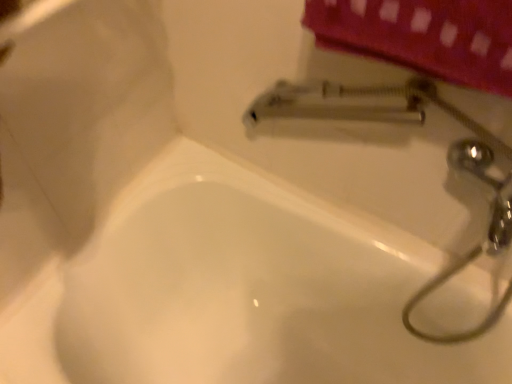
Find the location of a particular element. chrome metallic faucet at upper right is located at coordinates (447, 159).

This screenshot has height=384, width=512. Describe the element at coordinates (447, 159) in the screenshot. I see `chrome metallic faucet at upper right` at that location.

At what (x,y) coordinates should I click in order to perform the action: click on chrome metallic faucet at upper right. Please return your answer as a coordinate pair (x, y). Image resolution: width=512 pixels, height=384 pixels. Looking at the image, I should click on (447, 159).